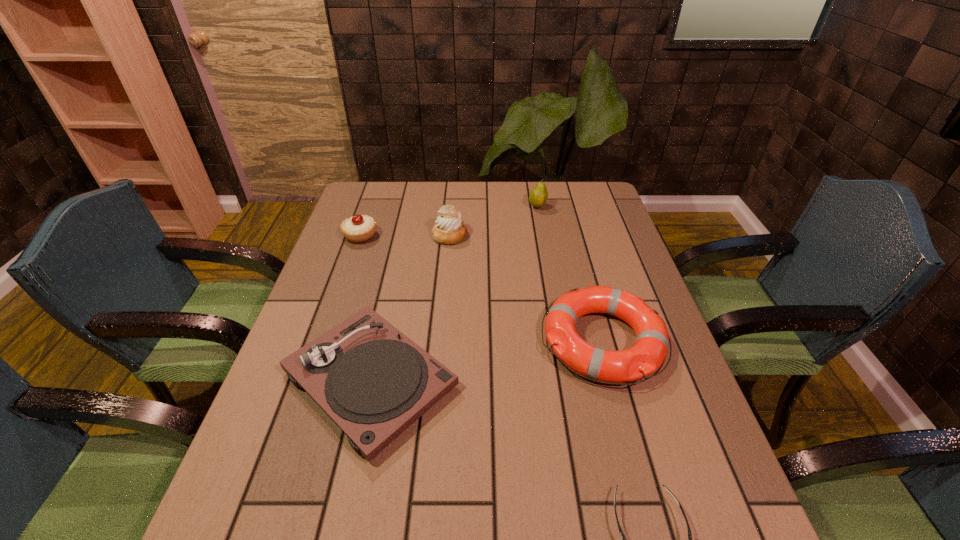
The width and height of the screenshot is (960, 540). I want to click on object at the far edge, so click(538, 196).

The width and height of the screenshot is (960, 540). I want to click on pastry at the left edge, so click(358, 228).

You are a GUI agent. You are given a task and a screenshot of the screen. Output one action in this format:
    pyautogui.click(x=<x>, y=<y>)
    Task: Click on the phonograph_record present at the left edge
    The width and height of the screenshot is (960, 540).
    Given the screenshot: What is the action you would take?
    pyautogui.click(x=374, y=382)

This screenshot has width=960, height=540. Find the location of `object present at the right edge`. object present at the right edge is located at coordinates (648, 353).

You are a GUI agent. You are given a task and a screenshot of the screen. Output one action in this format:
    pyautogui.click(x=<x>, y=<y>)
    Task: Click on the free space at the far edge of the desktop
    
    Given the screenshot: What is the action you would take?
    pyautogui.click(x=517, y=213)

Where is `blank space at the left edge of the desktop`? This screenshot has height=540, width=960. blank space at the left edge of the desktop is located at coordinates (335, 249).

Locate an element on the screen. The image size is (960, 540). vacant space at the right edge of the desktop is located at coordinates (653, 306).

Find the location of a particular element. This screenshot has height=540, width=960. vacant space at the far left corner is located at coordinates (362, 192).

You are a GUI agent. You are given a task and a screenshot of the screen. Output one action in this format:
    pyautogui.click(x=<x>, y=<y>)
    Task: Click on the empty space that is in between the right pastry and the phonograph_record
    This screenshot has height=540, width=960.
    Given the screenshot: What is the action you would take?
    pyautogui.click(x=410, y=307)

Image resolution: width=960 pixels, height=540 pixels. I want to click on unoccupied area between the taller pastry and the farthest object, so click(493, 221).